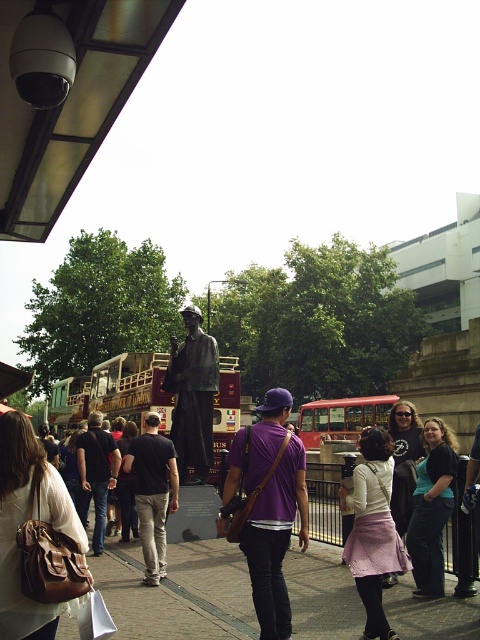
You are a photographer trying to capture both the dark gray fabric pants at center and the red metallic bus at center in the same frame. Given their sizes, which object will require you to step back more to include it fully in your photo?

The red metallic bus at center requires stepping back more because its width is greater than the dark gray fabric pants at center, necessitating a wider angle or greater distance to capture it fully.

You are a photographer trying to capture a clear photo of the bronze statue at center. However, there is a person wearing dark gray fabric pants at center blocking your view. Can you move around the statue to get an unobstructed shot?

The dark gray fabric pants at center is behind the bronze statue at center, so you can move around to the front of the bronze statue at center to avoid the obstruction.

You are a tourist standing in front of the statue and want to take a photo of the brick red tour bus at center without any people in the frame. The dark gray fabric pants at center are blocking your view. Can you look up or down to avoid the pants and still see the bus?

Yes, the brick red tour bus at center is located above the dark gray fabric pants at center, so by looking up slightly, you can avoid the pants and still see the bus.